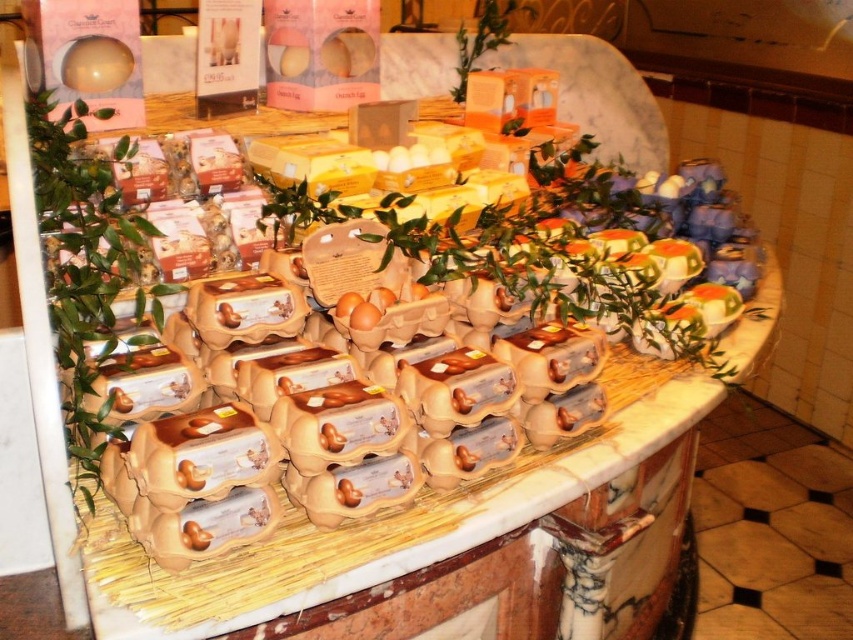
Can you confirm if green leafy plant at left is positioned above green leafy plant at upper center?

No, green leafy plant at left is not above green leafy plant at upper center.

Which of these two, green leafy plant at left or green leafy plant at upper center, stands shorter?

green leafy plant at upper center

What do you see at coordinates (85, 266) in the screenshot? I see `green leafy plant at left` at bounding box center [85, 266].

The height and width of the screenshot is (640, 853). I want to click on green leafy plant at left, so click(x=85, y=266).